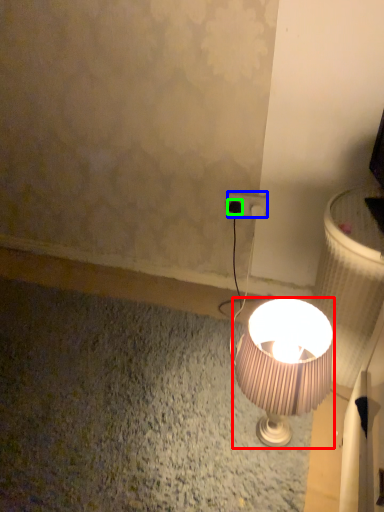
Question: Which is farther away from lamp (highlighted by a red box)? power plugs and sockets (highlighted by a blue box) or plug (highlighted by a green box)?

Choices:
 (A) power plugs and sockets
 (B) plug

Answer: (B)